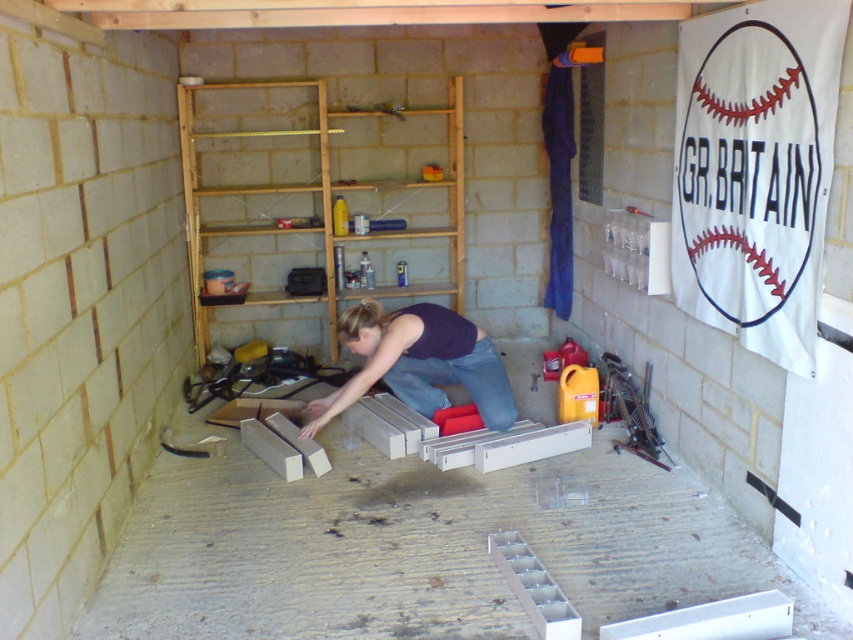
Which is in front, point (248, 520) or point (386, 378)?

Point (248, 520) is more forward.

Which is behind, point (538, 506) or point (480, 413)?

Positioned behind is point (480, 413).

This screenshot has width=853, height=640. I want to click on white matte wood at center, so click(x=418, y=547).